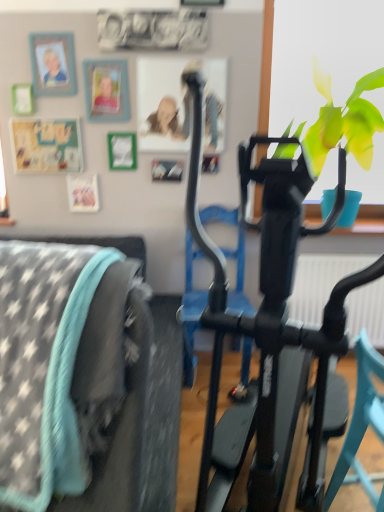
Question: Considering the relative sizes of matte plastic picture frame at upper left, the 2th picture frame positioned from the left, and black matte stationary bicycle at center in the image provided, is matte plastic picture frame at upper left, the 2th picture frame positioned from the left, thinner than black matte stationary bicycle at center?

Choices:
 (A) yes
 (B) no

Answer: (A)

Question: Are matte plastic picture frame at upper left, the 2th picture frame positioned from the left, and black matte stationary bicycle at center located far from each other?

Choices:
 (A) no
 (B) yes

Answer: (B)

Question: From a real-world perspective, is matte plastic picture frame at upper left, the 2th picture frame positioned from the left, on black matte stationary bicycle at center?

Choices:
 (A) yes
 (B) no

Answer: (A)

Question: From the image's perspective, is matte plastic picture frame at upper left, the 2th picture frame positioned from the left, on black matte stationary bicycle at center?

Choices:
 (A) yes
 (B) no

Answer: (A)

Question: Is matte plastic picture frame at upper left, positioned as the 1th picture frame in right-to-left order, outside of black matte stationary bicycle at center?

Choices:
 (A) yes
 (B) no

Answer: (A)

Question: In terms of size, does black matte stationary bicycle at center appear bigger or smaller than wooden photo frame at upper left, the 1th picture frame in the left-to-right sequence?

Choices:
 (A) small
 (B) big

Answer: (B)

Question: In the image, is black matte stationary bicycle at center positioned in front of or behind wooden photo frame at upper left, marked as the second picture frame in a right-to-left arrangement?

Choices:
 (A) behind
 (B) front

Answer: (B)

Question: Does point (296, 330) appear closer or farther from the camera than point (54, 92)?

Choices:
 (A) closer
 (B) farther

Answer: (A)

Question: Looking at their shapes, would you say black matte stationary bicycle at center is wider or thinner than wooden photo frame at upper left, marked as the second picture frame in a right-to-left arrangement?

Choices:
 (A) wide
 (B) thin

Answer: (A)

Question: Considering the positions of teal plastic chair at center and wooden photo frame at upper left, marked as the second picture frame in a right-to-left arrangement, in the image, is teal plastic chair at center taller or shorter than wooden photo frame at upper left, marked as the second picture frame in a right-to-left arrangement,?

Choices:
 (A) short
 (B) tall

Answer: (B)

Question: Considering the positions of point (364, 388) and point (41, 67), is point (364, 388) closer or farther from the camera than point (41, 67)?

Choices:
 (A) closer
 (B) farther

Answer: (A)

Question: Is teal plastic chair at center in front of or behind wooden photo frame at upper left, the 1th picture frame in the left-to-right sequence, in the image?

Choices:
 (A) behind
 (B) front

Answer: (B)

Question: Looking at their shapes, would you say teal plastic chair at center is wider or thinner than wooden photo frame at upper left, marked as the second picture frame in a right-to-left arrangement?

Choices:
 (A) wide
 (B) thin

Answer: (A)

Question: Is matte plastic picture frame at upper left, the 2th picture frame positioned from the left, situated inside teal plastic chair at center or outside?

Choices:
 (A) inside
 (B) outside

Answer: (B)

Question: Relative to teal plastic chair at center, is matte plastic picture frame at upper left, the 2th picture frame positioned from the left, in front or behind?

Choices:
 (A) behind
 (B) front

Answer: (A)